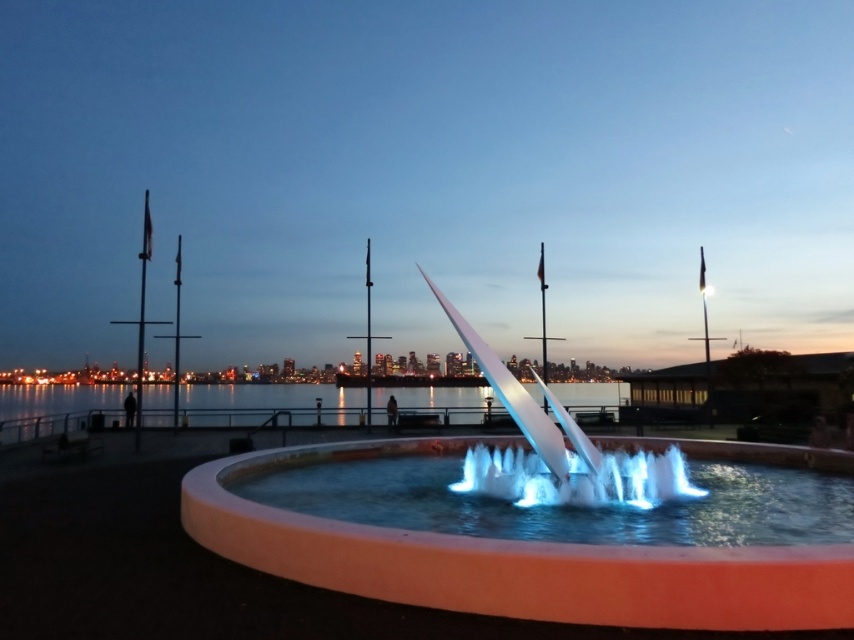
Based on the scene description, where is the translucent glass water at center located in the image?

The translucent glass water at center is located at point (568, 497).

You are standing at the edge of the waterfront promenade and want to locate the white glossy fountain at center. According to the coordinates provided, in which direction should you look relative to your position?

The white glossy fountain at center is located at coordinates point (518, 561). Since coordinates typically range from 0 to 1, this places it towards the upper right of the image, so you should look towards the upper right direction from your position.

You are a photographer planning to capture the fountain and water in the scene. The white glossy fountain at center and the clear water at center are both in your viewfinder. Based on their positions, which object would appear larger in your photo?

The white glossy fountain at center appears larger in the photo because it is positioned above the clear water at center, making it closer to the camera and thus larger in the frame.